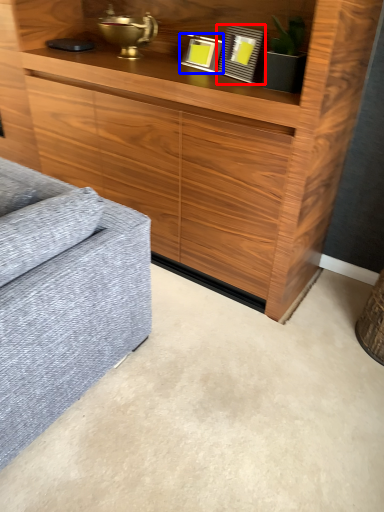
Question: Which of the following is the farthest to the observer, picture frame (highlighted by a red box) or picture frame (highlighted by a blue box)?

Choices:
 (A) picture frame
 (B) picture frame

Answer: (B)